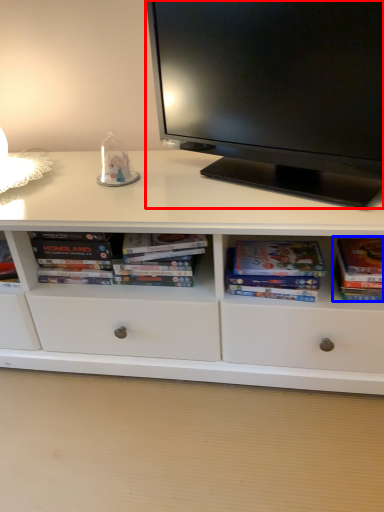
Question: Among these objects, which one is nearest to the camera, television (highlighted by a red box) or paperback book (highlighted by a blue box)?

Choices:
 (A) television
 (B) paperback book

Answer: (A)